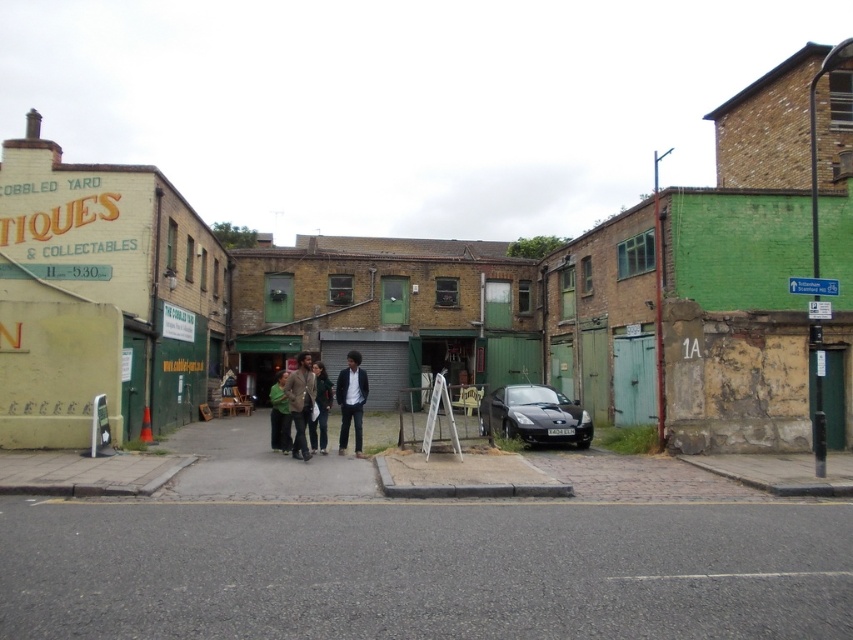
Question: Which object is the farthest from the dark brown leather jacket at center?

Choices:
 (A) dark blue jeans at center
 (B) shiny black car at center
 (C) green fabric jacket at center

Answer: (B)

Question: Is dark brown leather jacket at center to the left of dark green jacket at center from the viewer's perspective?

Choices:
 (A) yes
 (B) no

Answer: (A)

Question: Among these objects, which one is farthest from the camera?

Choices:
 (A) dark brown leather jacket at center
 (B) green fabric jacket at center
 (C) dark blue jeans at center
 (D) dark green jacket at center

Answer: (D)

Question: Does shiny black car at center have a greater width compared to green fabric jacket at center?

Choices:
 (A) yes
 (B) no

Answer: (B)

Question: Which is nearer to the dark blue jeans at center?

Choices:
 (A) green fabric jacket at center
 (B) dark green jacket at center
 (C) shiny black car at center
 (D) dark brown leather jacket at center

Answer: (D)

Question: Does shiny black car at center have a larger size compared to dark green jacket at center?

Choices:
 (A) no
 (B) yes

Answer: (A)